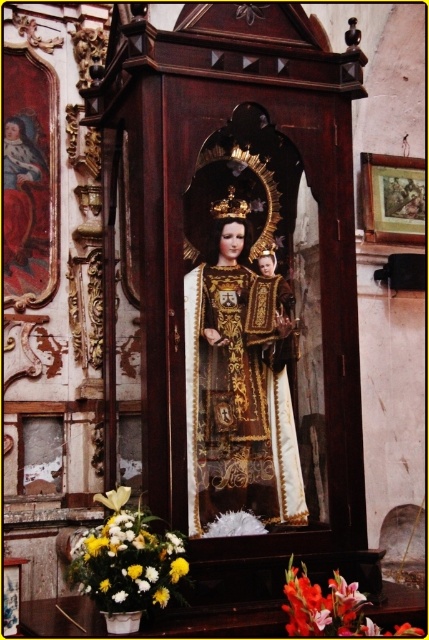
Question: Does gold embroidered robe at center have a greater width compared to yellow matte flower at lower left?

Choices:
 (A) no
 (B) yes

Answer: (B)

Question: Which object is positioned closest to the white floral arrangement at lower left?

Choices:
 (A) yellow matte flower at lower left
 (B) smooth orange gladiolus at lower center
 (C) gold embroidered robe at center

Answer: (A)

Question: Does smooth orange gladiolus at lower center have a smaller size compared to yellow matte flower at lower left?

Choices:
 (A) yes
 (B) no

Answer: (A)

Question: Is gold embroidered robe at center further to the viewer compared to white floral arrangement at lower left?

Choices:
 (A) yes
 (B) no

Answer: (A)

Question: Among these objects, which one is farthest from the camera?

Choices:
 (A) white floral arrangement at lower left
 (B) gold embroidered robe at center
 (C) yellow matte flower at lower left

Answer: (B)

Question: Which of the following is the farthest from the observer?

Choices:
 (A) (298, 611)
 (B) (217, 464)

Answer: (B)